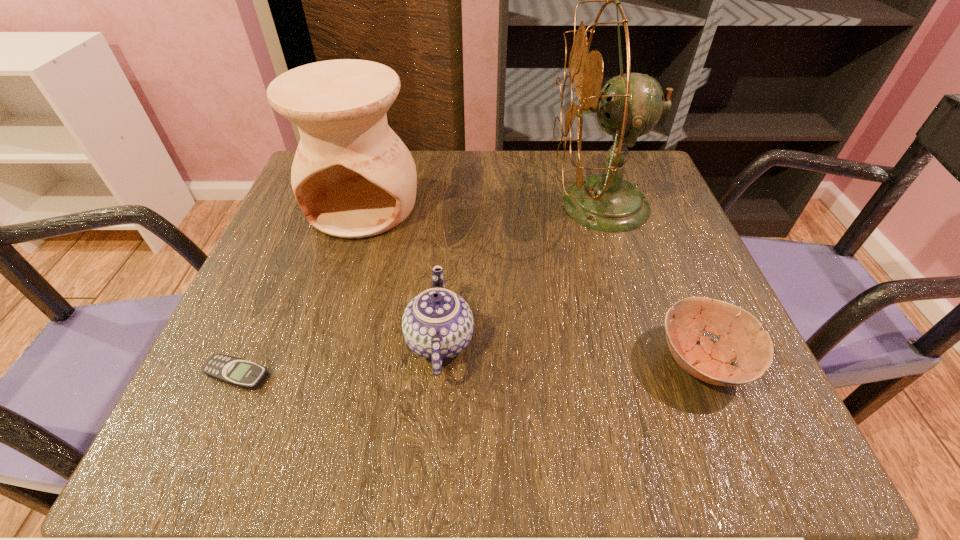
Identify which object is the nearest to the third tallest object. Please provide its 2D coordinates. Your answer should be formatted as a tuple, i.e. [(x, y)], where the tuple contains the x and y coordinates of a point satisfying the conditions above.

[(353, 177)]

At what (x,y) coordinates should I click in order to perform the action: click on vacant space that satisfies the following two spatial constraints: 1. at the spout of the bowl; 2. on the left side of the chinaware. Please return your answer as a coordinate pair (x, y). Image resolution: width=960 pixels, height=540 pixels. Looking at the image, I should click on (439, 361).

At what (x,y) coordinates should I click in order to perform the action: click on vacant region that satisfies the following two spatial constraints: 1. on the back side of the beeper; 2. on the left side of the bowl. Please return your answer as a coordinate pair (x, y). Looking at the image, I should click on (242, 361).

Identify the location of vacant region that satisfies the following two spatial constraints: 1. on the back side of the second shortest object; 2. on the right side of the shortest object. The image size is (960, 540). (242, 361).

Locate an element on the screen. vacant region that satisfies the following two spatial constraints: 1. at the spout of the chinaware; 2. on the right side of the bowl is located at coordinates (439, 361).

This screenshot has width=960, height=540. I want to click on vacant point that satisfies the following two spatial constraints: 1. at the spout of the third object from right to left; 2. on the right side of the fourth tallest object, so click(x=439, y=361).

The width and height of the screenshot is (960, 540). I want to click on vacant space that satisfies the following two spatial constraints: 1. in front of the fan, directing air flow; 2. on the back side of the second shortest object, so click(649, 361).

What are the coordinates of `free point that satisfies the following two spatial constraints: 1. at the open side of the second tallest object; 2. on the left side of the bowl` in the screenshot? It's located at (315, 361).

Where is `free spot that satisfies the following two spatial constraints: 1. in front of the tallest object, directing air flow; 2. on the back side of the second shortest object`? The image size is (960, 540). free spot that satisfies the following two spatial constraints: 1. in front of the tallest object, directing air flow; 2. on the back side of the second shortest object is located at coordinates (649, 361).

You are a GUI agent. You are given a task and a screenshot of the screen. Output one action in this format:
    pyautogui.click(x=<x>, y=<y>)
    Task: Click on the free space that satisfies the following two spatial constraints: 1. in front of the tallest object, directing air flow; 2. on the back side of the second shortest object
    The width and height of the screenshot is (960, 540).
    Given the screenshot: What is the action you would take?
    pyautogui.click(x=649, y=361)